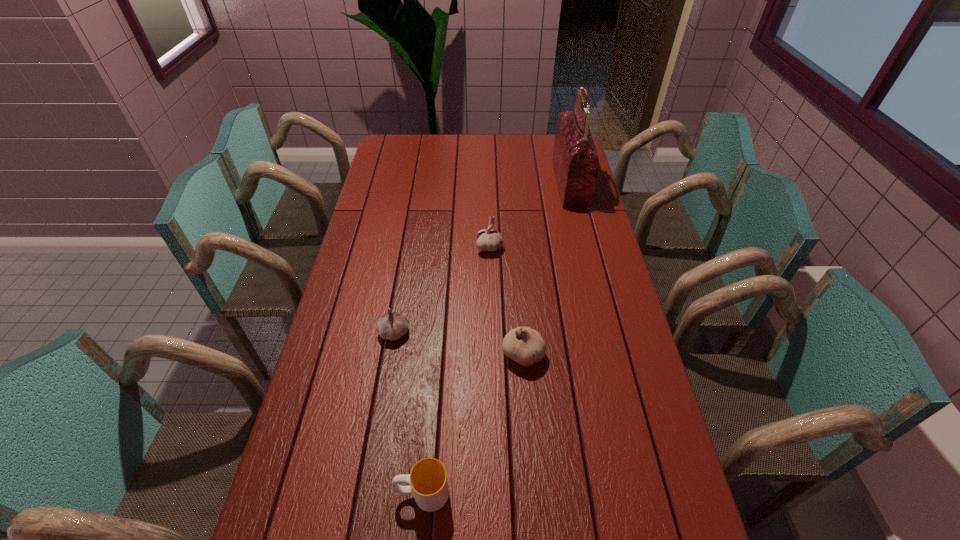
The height and width of the screenshot is (540, 960). I want to click on the tallest object, so click(576, 164).

Identify the location of handbag. The height and width of the screenshot is (540, 960). (576, 164).

This screenshot has width=960, height=540. I want to click on the farthest garlic, so click(487, 239).

Find the location of a particular element. The width and height of the screenshot is (960, 540). the leftmost garlic is located at coordinates (392, 326).

This screenshot has width=960, height=540. What are the coordinates of `the fourth object from right to left` in the screenshot? It's located at (428, 482).

Locate an element on the screen. The height and width of the screenshot is (540, 960). the nearest object is located at coordinates [428, 482].

Where is `free space located 0.050m on the front-facing side of the rightmost object`? This screenshot has width=960, height=540. free space located 0.050m on the front-facing side of the rightmost object is located at coordinates (544, 183).

Find the location of `vacant space located 0.120m on the front-facing side of the rightmost object`. vacant space located 0.120m on the front-facing side of the rightmost object is located at coordinates (527, 183).

The height and width of the screenshot is (540, 960). In order to click on vacant space located 0.190m on the front-facing side of the rightmost object in this screenshot , I will do `click(510, 183)`.

Image resolution: width=960 pixels, height=540 pixels. I want to click on free space located 0.210m on the front of the farthest garlic, so click(x=491, y=304).